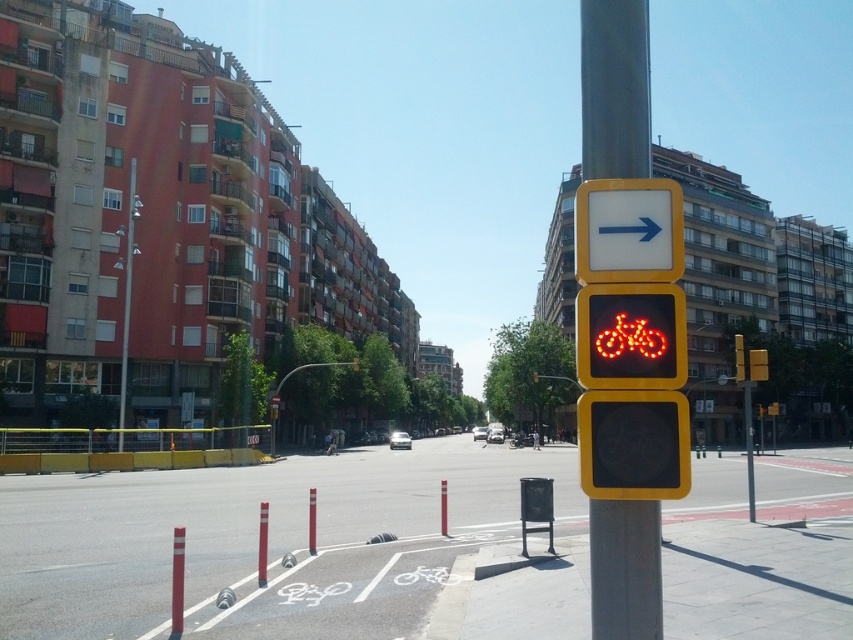
Question: Estimate the real-world distances between objects in this image. Which object is farther from the metallic pole at left?

Choices:
 (A) white plastic arrow at upper right
 (B) yellow plastic pole at right

Answer: (B)

Question: Is white plastic arrow at upper right above metallic pole at left?

Choices:
 (A) yes
 (B) no

Answer: (A)

Question: Can you confirm if yellow plastic pole at right is positioned above led illuminated bicycle at right?

Choices:
 (A) no
 (B) yes

Answer: (A)

Question: Which of the following is the closest to the observer?

Choices:
 (A) led illuminated bicycle at right
 (B) metallic pole at left
 (C) white plastic arrow at upper right
 (D) yellow plastic pole at right

Answer: (A)

Question: Can you confirm if led illuminated bicycle at right is smaller than metallic pole at left?

Choices:
 (A) yes
 (B) no

Answer: (A)

Question: Which of these objects is positioned closest to the metallic pole at left?

Choices:
 (A) white plastic arrow at upper right
 (B) led illuminated bicycle at right

Answer: (A)